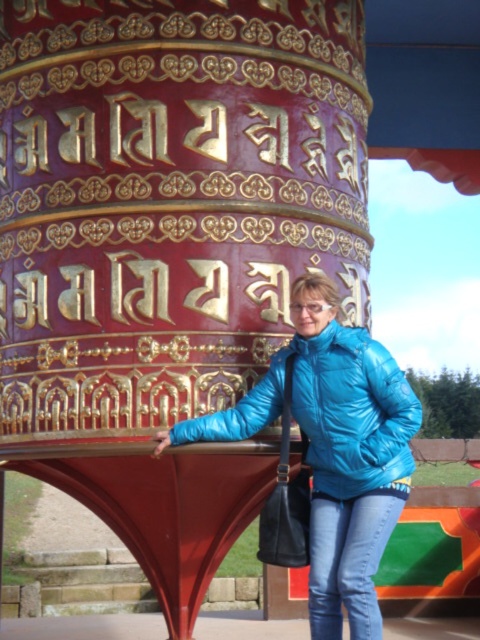
You are a photographer trying to capture the person in the blue glossy jacket at center and the blue shiny jacket at center. Which jacket should you focus on if you want to photograph the taller one?

The blue glossy jacket at center is much taller than the blue shiny jacket at center, so you should focus on the blue glossy jacket at center.

You are a photographer trying to capture the intricate details of the prayer wheel and the person in the scene. Which object is positioned lower on the person, the blue glossy jacket at center or the blue shiny jacket at center?

The blue glossy jacket at center is positioned lower than the blue shiny jacket at center on the person.